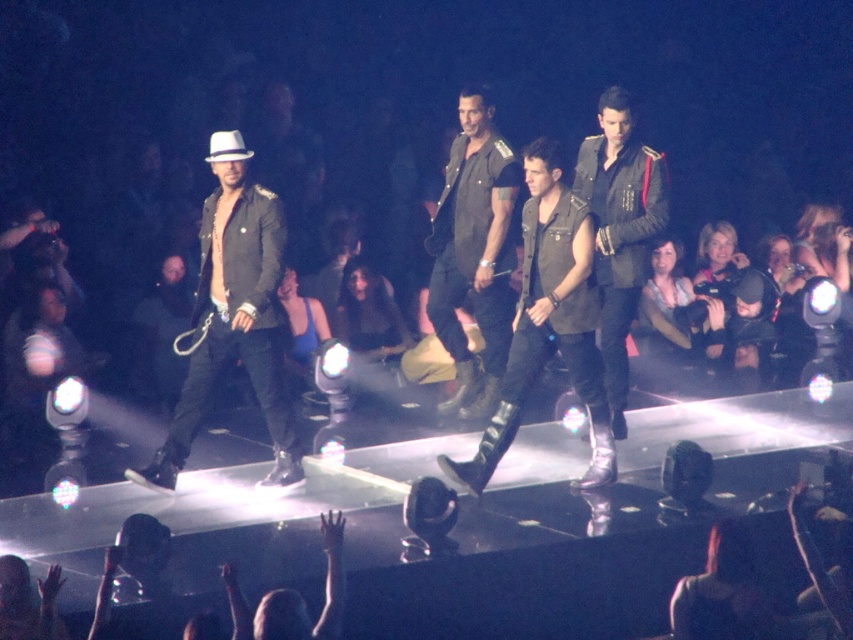
You are a photographer at the concert. You want to capture a photo of the dark green military jacket at center without the matte black boots at center blocking it. Can you adjust your position to do so?

The matte black boots at center is in front of the dark green military jacket at center, so you need to position yourself behind the matte black boots at center to capture the dark green military jacket at center without obstruction.